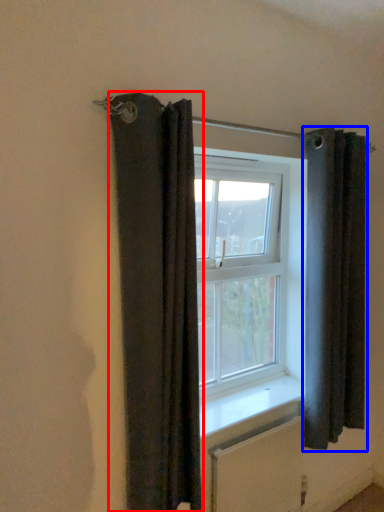
Question: Among these objects, which one is farthest to the camera, curtain (highlighted by a red box) or curtain (highlighted by a blue box)?

Choices:
 (A) curtain
 (B) curtain

Answer: (B)